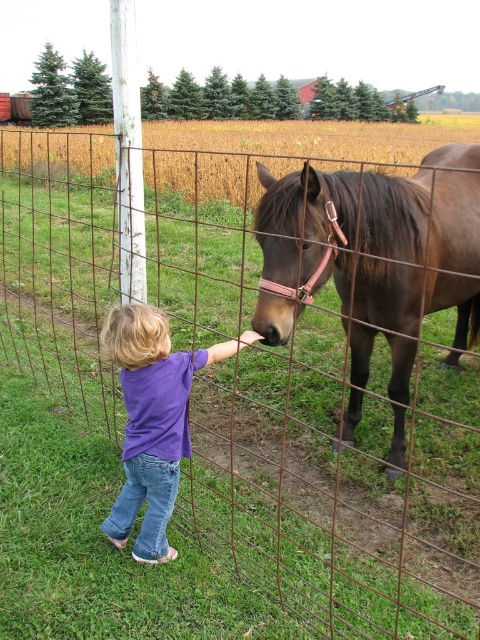
Can you confirm if brown glossy horse at center is positioned to the left of purple cotton shirt at center?

Incorrect, brown glossy horse at center is not on the left side of purple cotton shirt at center.

Between brown glossy horse at center and purple cotton shirt at center, which one has more height?

Standing taller between the two is brown glossy horse at center.

Which is behind, point (399, 400) or point (137, 384)?

The point (399, 400) is behind.

What are the coordinates of `brown glossy horse at center` in the screenshot? It's located at (377, 257).